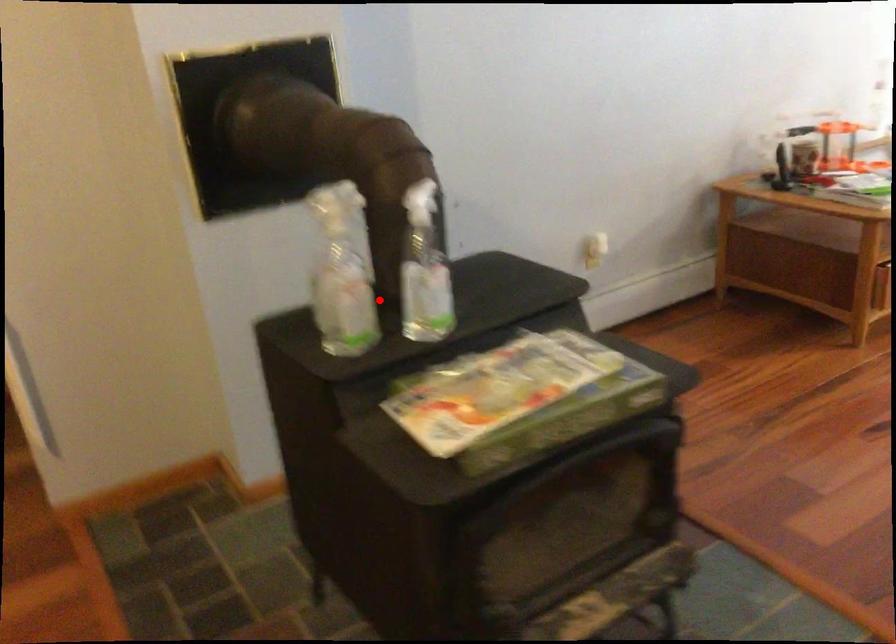
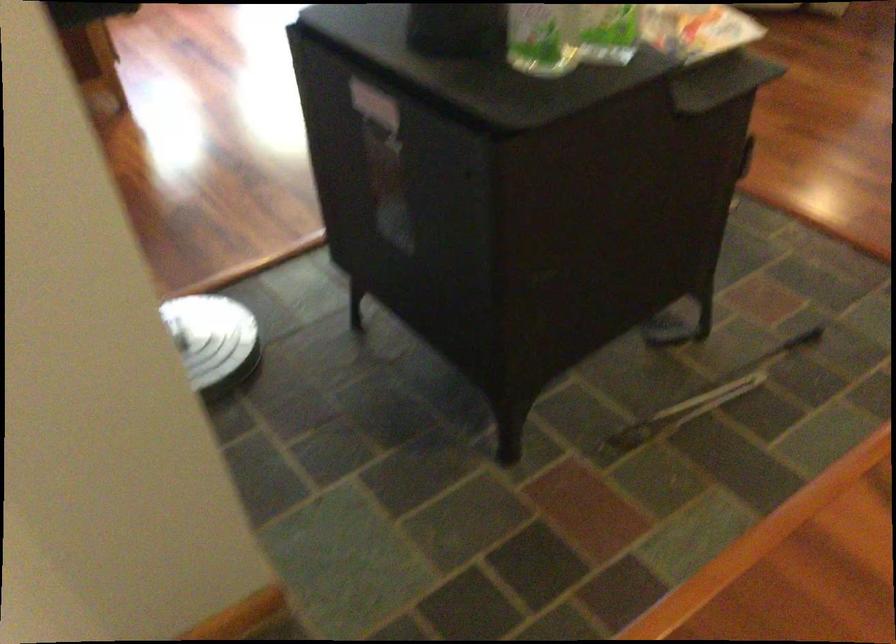
Question: I am providing you with two images of the same scene from different viewpoints. Image1 has a red point marked. In image2, the corresponding 3D location appears at what relative position? Reply with the corresponding letter.

Choices:
 (A) Closer
 (B) Farther

Answer: (A)